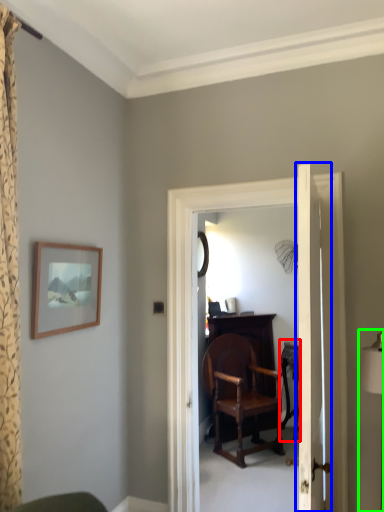
Question: Which object is the closest to the table (highlighted by a red box)? Choose among these: door (highlighted by a blue box) or table lamp (highlighted by a green box).

Choices:
 (A) door
 (B) table lamp

Answer: (B)